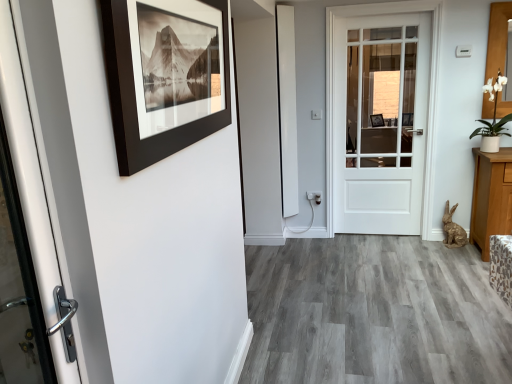
The height and width of the screenshot is (384, 512). Describe the element at coordinates (493, 117) in the screenshot. I see `white ceramic pot at upper right` at that location.

Find the location of a particular element. This screenshot has height=384, width=512. black matte picture frame at upper left is located at coordinates (162, 81).

Considering the sizes of white matte door at center and black matte picture frame at upper left in the image, is white matte door at center bigger or smaller than black matte picture frame at upper left?

In the image, white matte door at center appears to be larger than black matte picture frame at upper left.

Is white matte door at center oriented away from black matte picture frame at upper left?

No, white matte door at center is not facing the opposite direction of black matte picture frame at upper left.

How different are the orientations of white matte door at center and white ceramic pot at upper right in degrees?

1.37 degrees separate the facing orientations of white matte door at center and white ceramic pot at upper right.

Is white matte door at center not near white ceramic pot at upper right?

No, white matte door at center is in close proximity to white ceramic pot at upper right.

In the image, is white matte door at center on the left side or the right side of white ceramic pot at upper right?

In the image, white matte door at center appears on the left side of white ceramic pot at upper right.

Looking at this image, can you confirm if white matte door at center is wider than white ceramic pot at upper right?

In fact, white matte door at center might be narrower than white ceramic pot at upper right.

From a real-world perspective, who is located lower, white ceramic pot at upper right or white matte door at center?

white matte door at center.

Identify the location of plant that appears above the white matte door at center (from the image's perspective). (493, 117).

Who is more distant, white ceramic pot at upper right or white matte door at center?

Positioned behind is white matte door at center.

Which is farther, [496,124] or [417,205]?

The point [417,205] is farther from the camera.

Based on their sizes in the image, would you say white ceramic pot at upper right is bigger or smaller than black matte picture frame at upper left?

Considering their sizes, white ceramic pot at upper right takes up more space than black matte picture frame at upper left.

Looking at this image, can we say white ceramic pot at upper right lies outside black matte picture frame at upper left?

Indeed, white ceramic pot at upper right is completely outside black matte picture frame at upper left.

Is point (497, 149) in front of point (189, 97)?

No, (497, 149) is further to viewer.

From the image's perspective, is white ceramic pot at upper right below black matte picture frame at upper left?

No, from the image's perspective, white ceramic pot at upper right is not beneath black matte picture frame at upper left.

Is black matte picture frame at upper left inside the boundaries of white matte door at center, or outside?

black matte picture frame at upper left is outside white matte door at center.

Which object is closer to the camera, black matte picture frame at upper left or white matte door at center?

black matte picture frame at upper left is in front.

Which point is more distant from viewer, (135, 101) or (333, 146)?

The point (333, 146) is farther from the camera.

Is black matte picture frame at upper left with white matte door at center?

They are not placed beside each other.

What's the angular difference between black matte picture frame at upper left and white ceramic pot at upper right's facing directions?

90.2 degrees separate the facing orientations of black matte picture frame at upper left and white ceramic pot at upper right.

Looking at this image, from the image's perspective, is black matte picture frame at upper left located beneath white ceramic pot at upper right?

Yes, from the image's perspective, black matte picture frame at upper left is below white ceramic pot at upper right.

Based on their sizes in the image, would you say black matte picture frame at upper left is bigger or smaller than white ceramic pot at upper right?

Clearly, black matte picture frame at upper left is smaller in size than white ceramic pot at upper right.

Is white ceramic pot at upper right at the back of black matte picture frame at upper left?

No.

Where is `picture frame on the left of white matte door at center`? The height and width of the screenshot is (384, 512). picture frame on the left of white matte door at center is located at coordinates (162, 81).

Locate an element on the screen. plant that appears above the white matte door at center (from a real-world perspective) is located at coordinates (493, 117).

When comparing their distances from white matte door at center, does white ceramic pot at upper right or black matte picture frame at upper left seem closer?

Based on the image, white ceramic pot at upper right appears to be nearer to white matte door at center.

When comparing their distances from white matte door at center, does black matte picture frame at upper left or white ceramic pot at upper right seem closer?

Based on the image, white ceramic pot at upper right appears to be nearer to white matte door at center.

Estimate the real-world distances between objects in this image. Which object is closer to black matte picture frame at upper left, white matte door at center or white ceramic pot at upper right?

white matte door at center is positioned closer to the anchor black matte picture frame at upper left.

Looking at the image, which one is located further to white ceramic pot at upper right, white matte door at center or black matte picture frame at upper left?

black matte picture frame at upper left is positioned further to the anchor white ceramic pot at upper right.

From the image, which object appears to be nearer to white ceramic pot at upper right, black matte picture frame at upper left or white matte door at center?

Based on the image, white matte door at center appears to be nearer to white ceramic pot at upper right.

Considering their positions, is white ceramic pot at upper right positioned further to black matte picture frame at upper left than white matte door at center?

white ceramic pot at upper right is further to black matte picture frame at upper left.

The width and height of the screenshot is (512, 384). In order to click on plant between black matte picture frame at upper left and white matte door at center from front to back in this screenshot , I will do point(493,117).